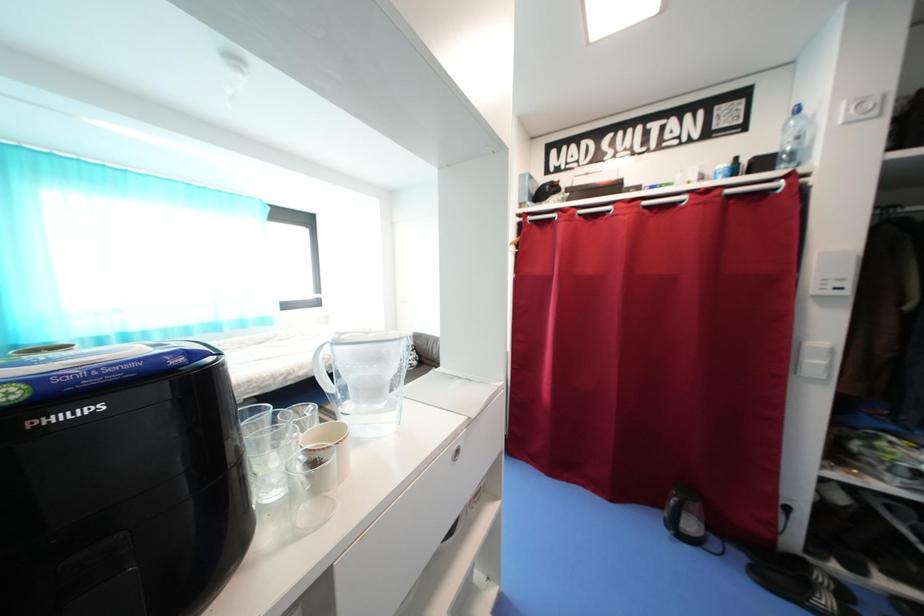
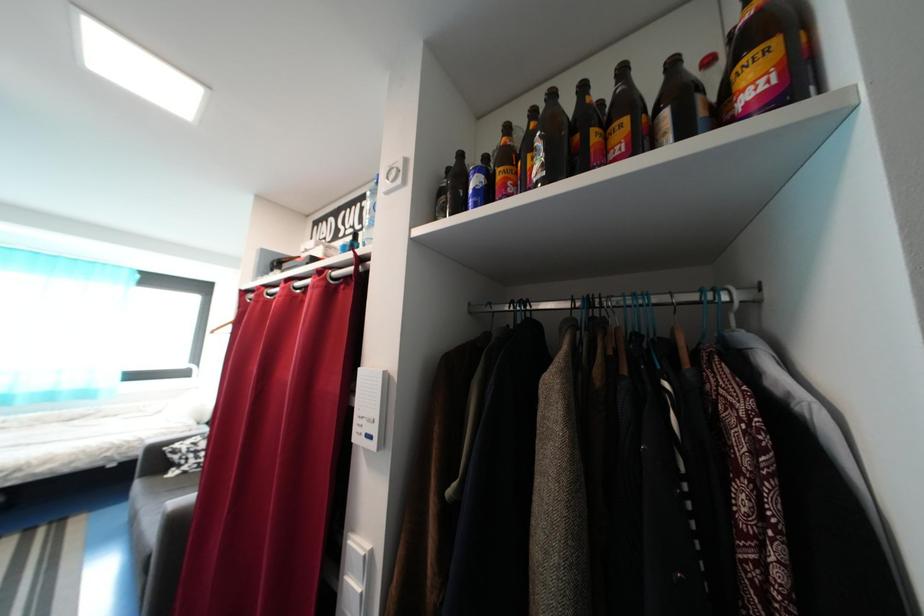
Question: In a continuous first-person perspective shot, in which direction is the camera moving?

Choices:
 (A) Left
 (B) Right
 (C) Forward
 (D) Backward

Answer: (B)